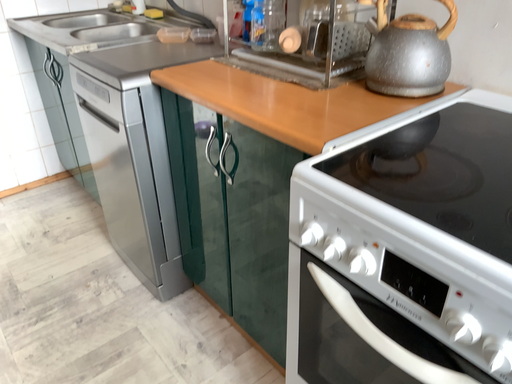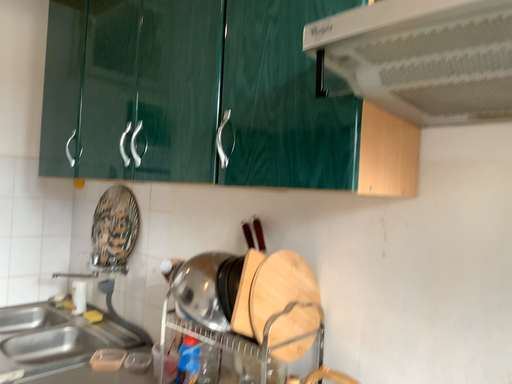
Question: Which way did the camera rotate in the video?

Choices:
 (A) rotated left
 (B) rotated right

Answer: (B)